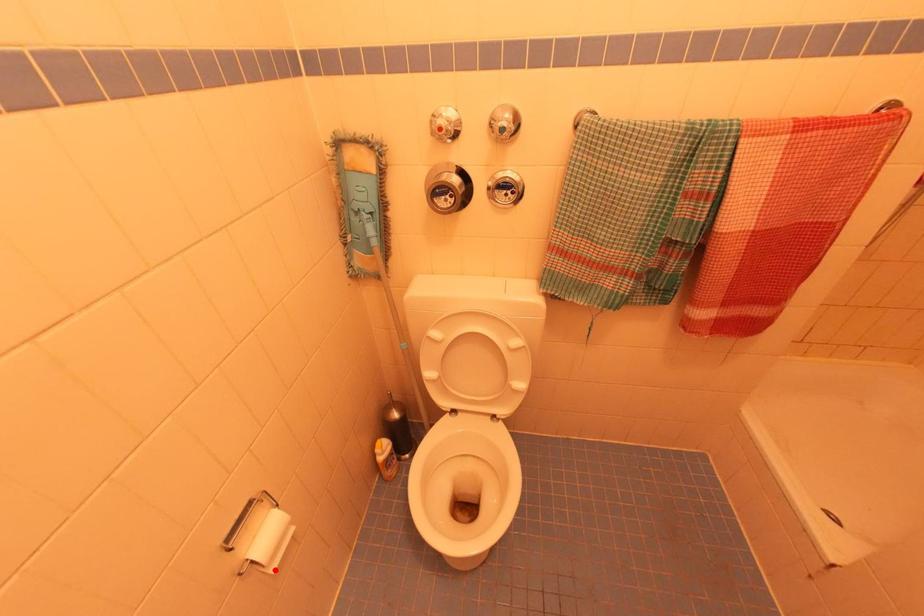
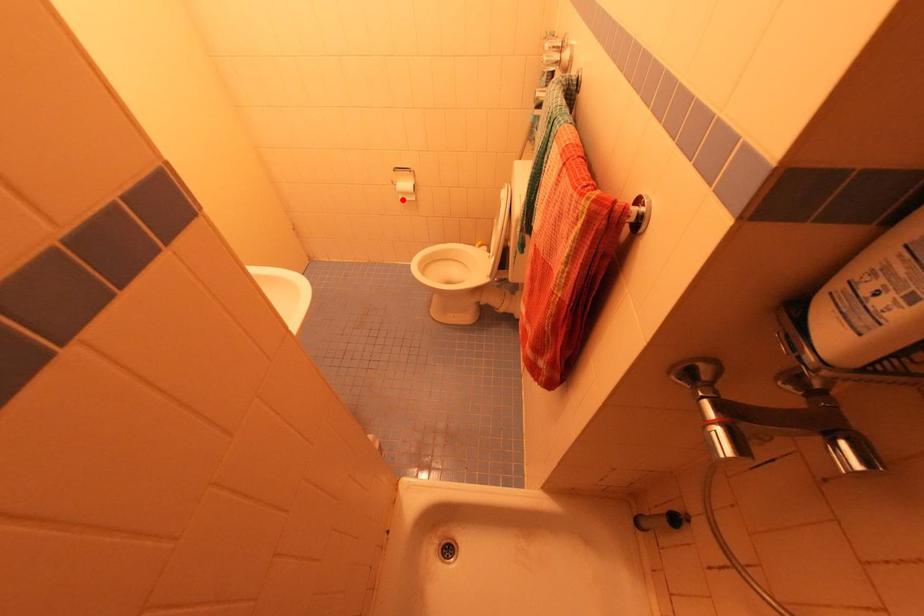
I am providing you with two images of the same scene from different viewpoints. A red point is marked on the first image and another point is marked on the second image. Is the marked point in image1 the same physical position as the marked point in image2?

Yes